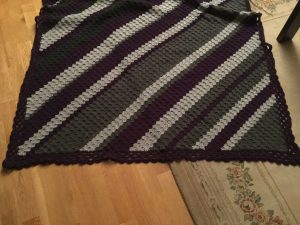
At what (x,y) coordinates should I click in order to perform the action: click on table leg. Please return your answer as a coordinate pair (x, y). Looking at the image, I should click on (292, 25).